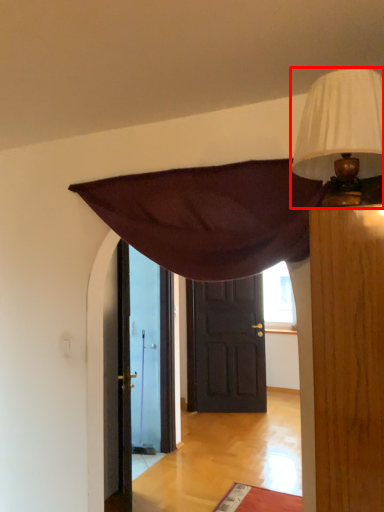
Question: From the image's perspective, where is lamp (annotated by the red box) located relative to door?

Choices:
 (A) above
 (B) below

Answer: (A)